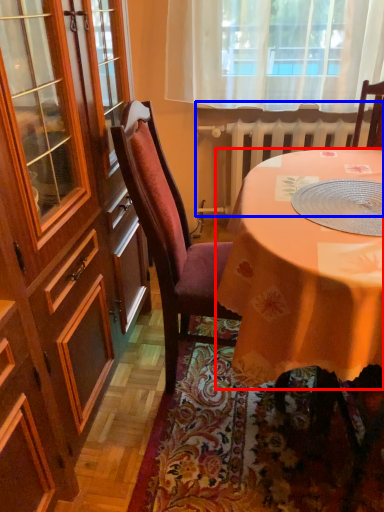
Question: Which object is closer to the camera taking this photo, desk (highlighted by a red box) or radiator (highlighted by a blue box)?

Choices:
 (A) desk
 (B) radiator

Answer: (A)